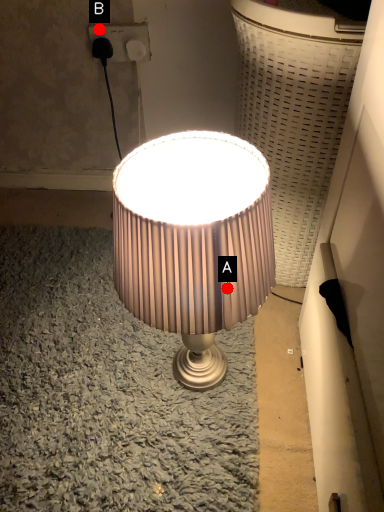
Question: Two points are circled on the image, labeled by A and B beside each circle. Which point is closer to the camera?

Choices:
 (A) A is closer
 (B) B is closer

Answer: (A)